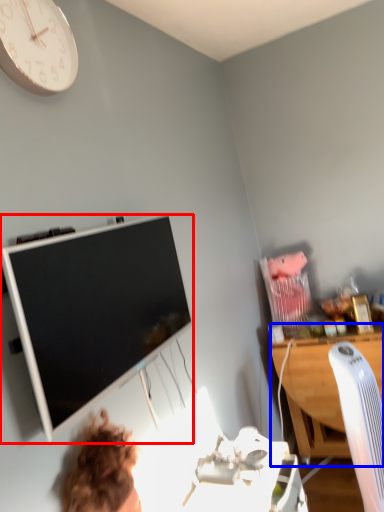
Question: Which object is further to the camera taking this photo, television (highlighted by a red box) or desk (highlighted by a blue box)?

Choices:
 (A) television
 (B) desk

Answer: (B)